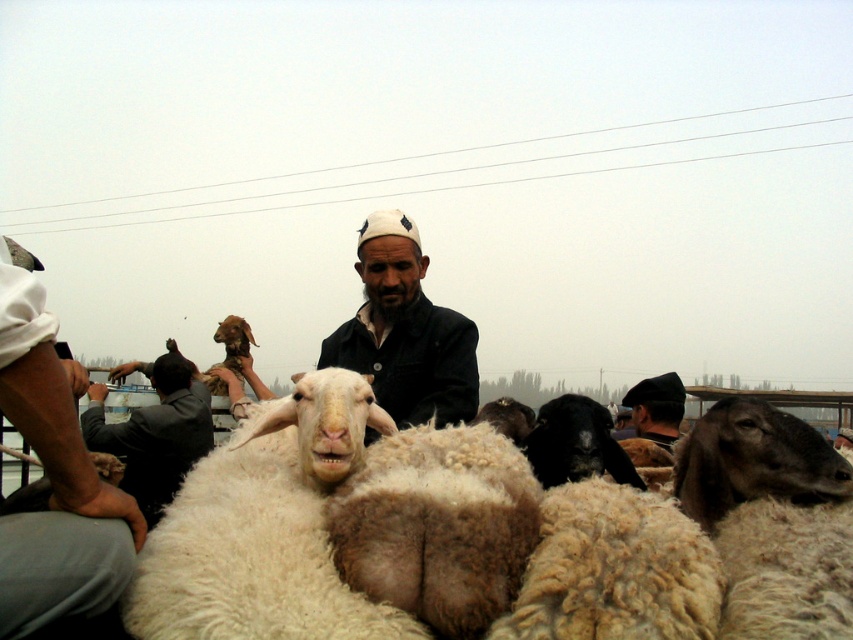
The width and height of the screenshot is (853, 640). Describe the element at coordinates (54, 477) in the screenshot. I see `white woolen sheep at lower left` at that location.

Between white woolen sheep at lower left and gray woolen jacket at left, which one has less height?

white woolen sheep at lower left

Does point (88, 612) come in front of point (160, 424)?

Yes, it is.

I want to click on white woolen sheep at lower left, so click(54, 477).

Can you confirm if white woolen sheep at center is positioned to the right of white woolen sheep at lower left?

Yes, white woolen sheep at center is to the right of white woolen sheep at lower left.

Based on the photo, is white woolen sheep at center taller than white woolen sheep at lower left?

No.

The height and width of the screenshot is (640, 853). Find the location of `white woolen sheep at center`. white woolen sheep at center is located at coordinates point(466,541).

Identify the location of white woolen sheep at center. pos(466,541).

Which of these two, white woolen sheep at center or black woolen goat at center, stands shorter?

With less height is black woolen goat at center.

Is white woolen sheep at center wider than black woolen goat at center?

Yes, white woolen sheep at center is wider than black woolen goat at center.

Is point (376, 444) less distant than point (567, 449)?

Yes, point (376, 444) is closer to viewer.

Locate an element on the screen. The height and width of the screenshot is (640, 853). white woolen sheep at center is located at coordinates [x=466, y=541].